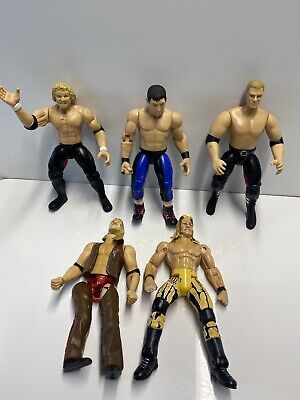
The width and height of the screenshot is (300, 400). Find the location of `action figures`. action figures is located at coordinates pos(240,132), pos(156,132), pos(66,132), pos(98,252), pos(179,271).